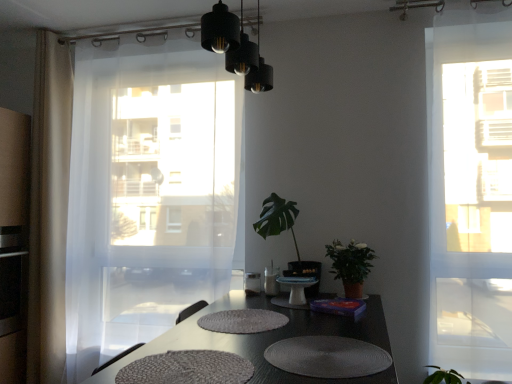
At what (x,y) coordinates should I click in order to perform the action: click on vacant space in white textured placemat at center (from a real-world perspective). Please return your answer as a coordinate pair (x, y). The height and width of the screenshot is (384, 512). Looking at the image, I should click on (250, 323).